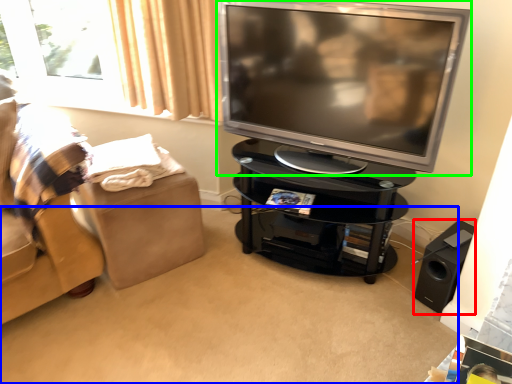
Question: Based on their relative distances, which object is farther from speaker (highlighted by a red box)? Choose from plain (highlighted by a blue box) and television (highlighted by a green box).

Choices:
 (A) plain
 (B) television

Answer: (B)